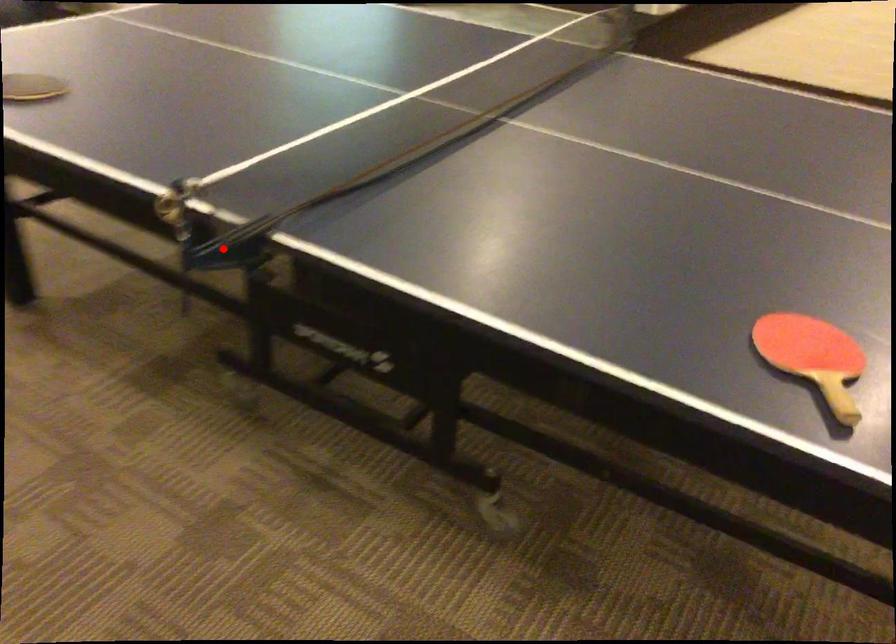
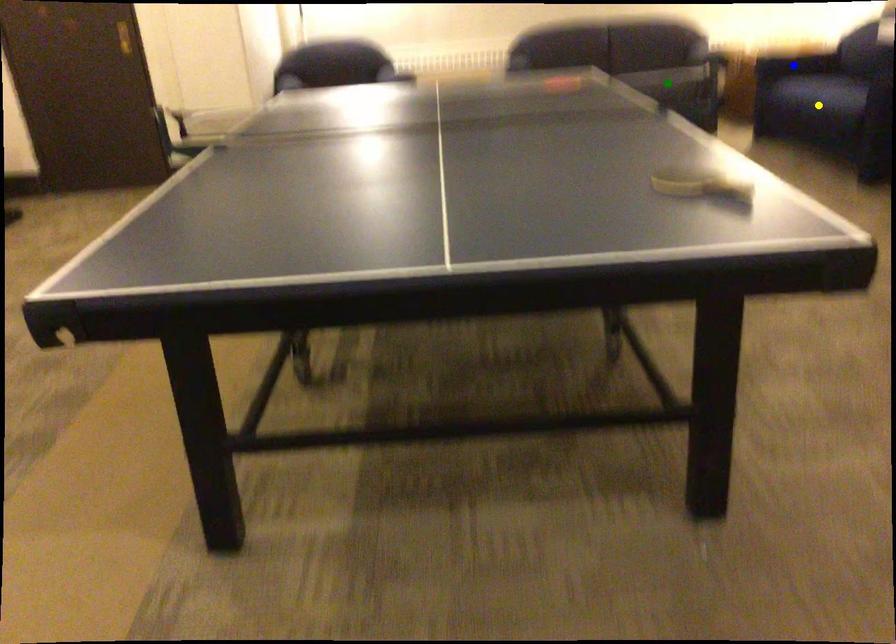
Question: I am providing you with two images of the same scene from different viewpoints. A red point is marked on the first image. You are given multiple points on the second image. Which spot in image 2 lines up with the point in image 1?

Choices:
 (A) yellow point
 (B) blue point
 (C) green point

Answer: (C)